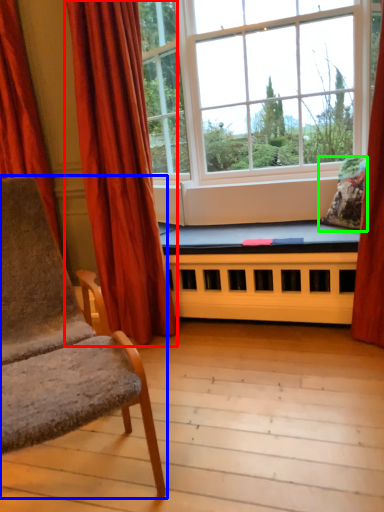
Question: Which object is positioned closest to curtain (highlighted by a red box)? Select from chair (highlighted by a blue box) and pillow (highlighted by a green box).

Choices:
 (A) chair
 (B) pillow

Answer: (A)